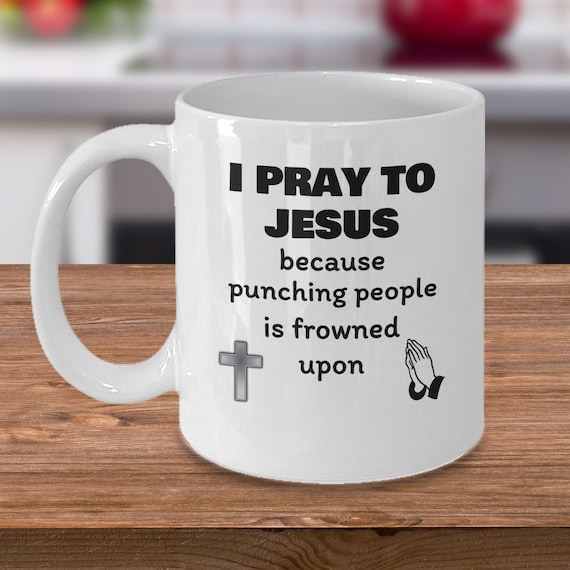
The width and height of the screenshot is (570, 570). I want to click on white cup mug left center, so click(x=148, y=149), click(x=34, y=275), click(x=70, y=357), click(x=140, y=385), click(x=180, y=333), click(x=188, y=214).